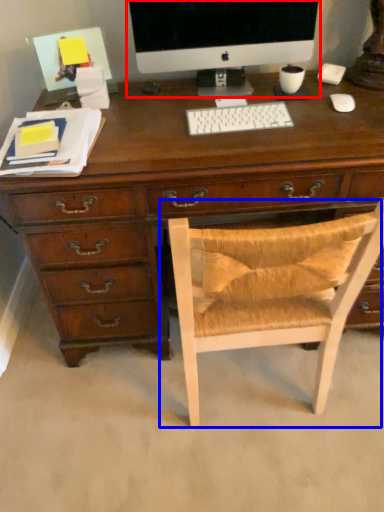
Question: Which object is further to the camera taking this photo, computer monitor (highlighted by a red box) or chair (highlighted by a blue box)?

Choices:
 (A) computer monitor
 (B) chair

Answer: (A)